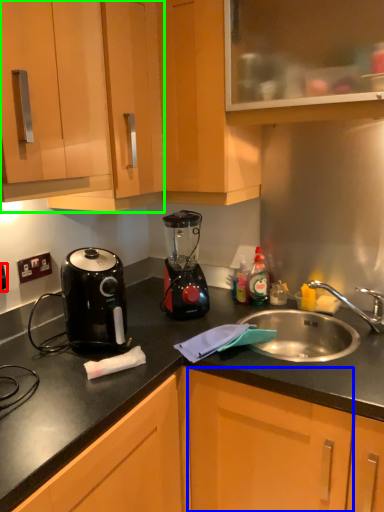
Question: Which object is the closest to the electric outlet (highlighted by a red box)? Choose among these: cabinetry (highlighted by a blue box) or cabinetry (highlighted by a green box).

Choices:
 (A) cabinetry
 (B) cabinetry

Answer: (B)